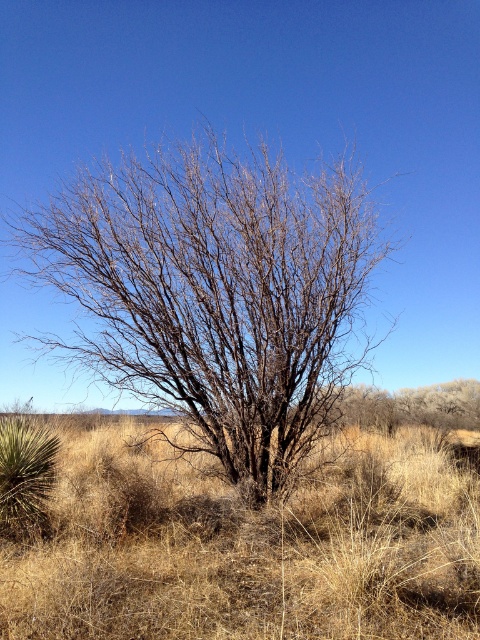
You are a hiker who wants to take a photo of the dry grass at center without the bare branches at center blocking the view. Which direction should you move to ensure the branches are out of frame?

The bare branches at center is to the left of dry grass at center, so you should move to the right side of the dry grass at center to avoid the branches blocking the view.

You are standing at point (215, 292) in the image. What do you see around you?

You are standing at point (215, 292) where the bare branches at center are located.